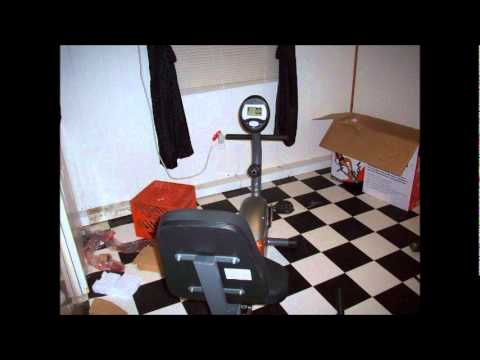
The width and height of the screenshot is (480, 360). What are the coordinates of `backrest bolts` in the screenshot? It's located at (234, 262), (240, 292), (192, 289), (178, 258).